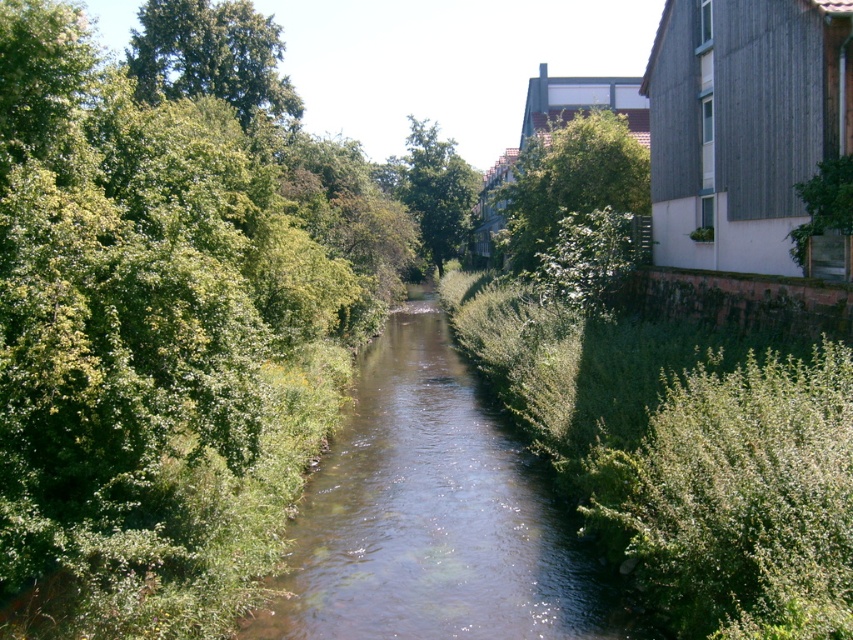
Is green leafy tree at upper left to the left of green leafy tree at upper center from the viewer's perspective?

Correct, you'll find green leafy tree at upper left to the left of green leafy tree at upper center.

Does green leafy tree at upper left have a larger size compared to green leafy tree at upper center?

No.

The image size is (853, 640). In order to click on green leafy tree at upper left in this screenshot , I will do `click(213, 60)`.

In the scene shown: Between green leafy tree at left and green leafy tree at center, which one appears on the left side from the viewer's perspective?

green leafy tree at left is more to the left.

Which is above, green leafy tree at left or green leafy tree at center?

green leafy tree at center is higher up.

At what (x,y) coordinates should I click in order to perform the action: click on green leafy tree at left. Please return your answer as a coordinate pair (x, y). The height and width of the screenshot is (640, 853). Looking at the image, I should click on (167, 314).

Between green leafy tree at left and green leafy tree at upper center, which one appears on the right side from the viewer's perspective?

Positioned to the right is green leafy tree at upper center.

Is green leafy tree at left above green leafy tree at upper center?

Actually, green leafy tree at left is below green leafy tree at upper center.

Locate an element on the screen. This screenshot has width=853, height=640. green leafy tree at left is located at coordinates (167, 314).